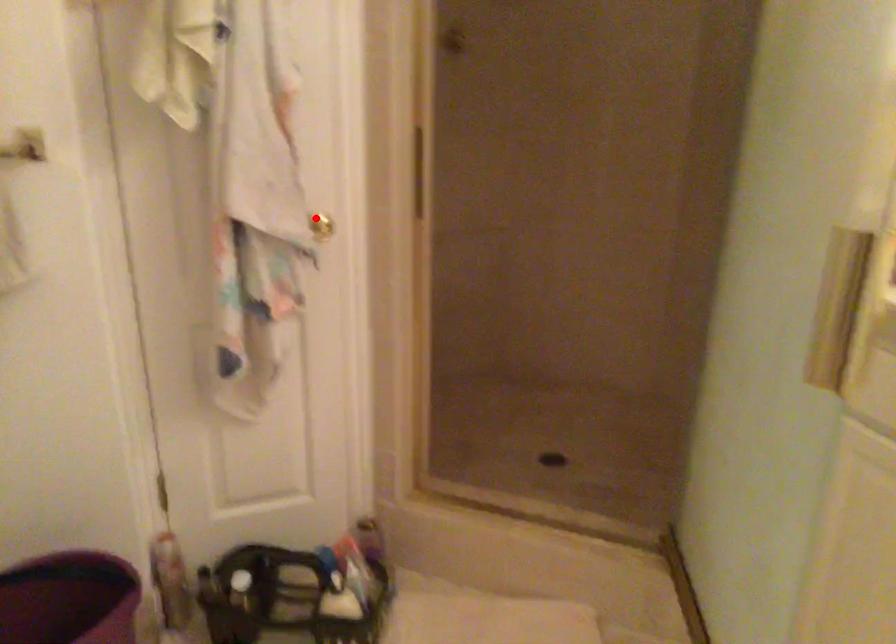
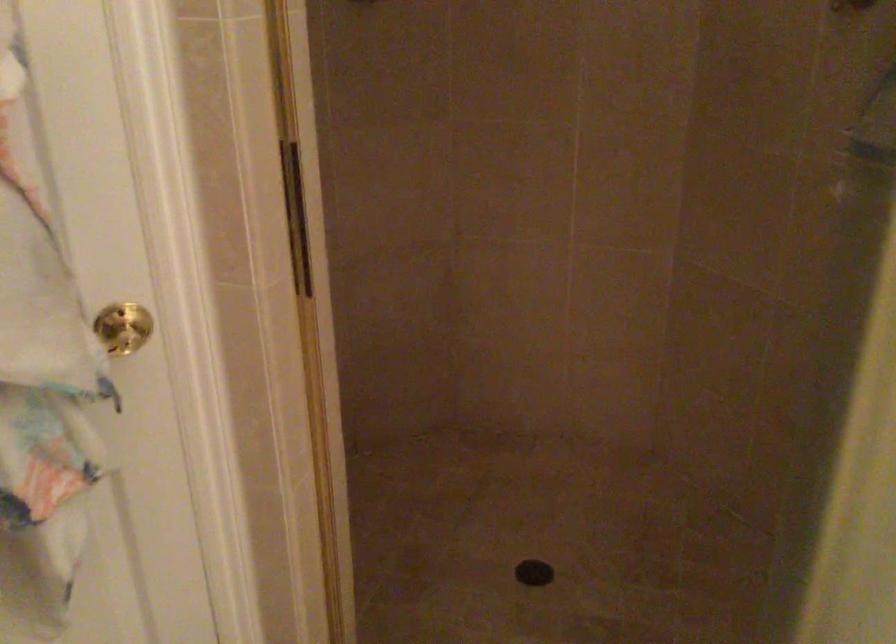
Find the pixel in the second image that matches the highlighted location in the first image.

(123, 328)